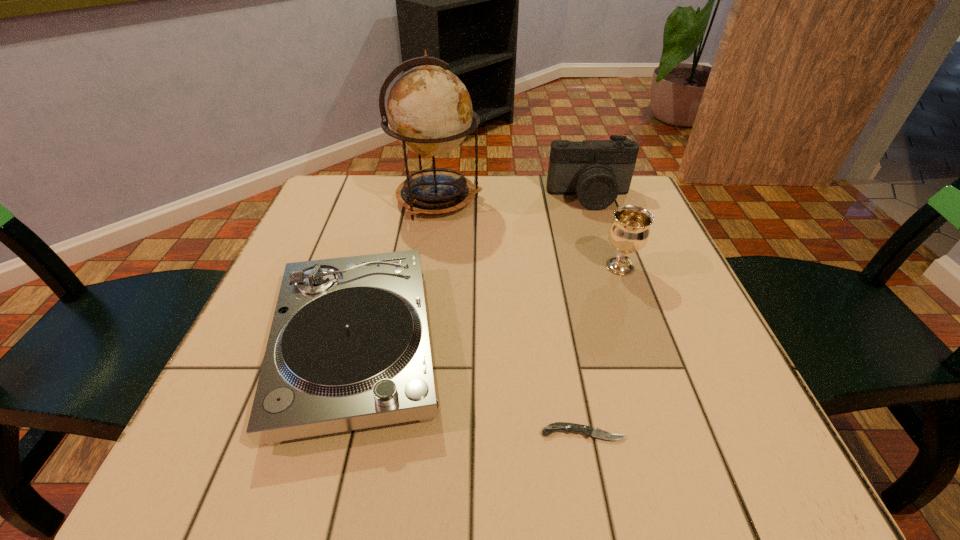
Identify the location of blank region between the chalice and the pocketknife. The height and width of the screenshot is (540, 960). (602, 350).

Identify the location of unoccupied position between the shortest object and the chalice. The width and height of the screenshot is (960, 540). (602, 350).

You are a GUI agent. You are given a task and a screenshot of the screen. Output one action in this format:
    pyautogui.click(x=<x>, y=<y>)
    Task: Click on the free space between the shortest object and the chalice
    Image resolution: width=960 pixels, height=540 pixels.
    Given the screenshot: What is the action you would take?
    pyautogui.click(x=602, y=350)

Find the location of `free point between the second shortest object and the pocketknife`. free point between the second shortest object and the pocketknife is located at coordinates (469, 389).

The image size is (960, 540). What are the coordinates of `empty space that is in between the globe and the shortest object` in the screenshot? It's located at (511, 316).

Select which object is the third closest to the fourth tallest object. Please provide its 2D coordinates. Your answer should be formatted as a tuple, i.e. [(x, y)], where the tuple contains the x and y coordinates of a point satisfying the conditions above.

[(629, 232)]

Find the location of a particular element. This screenshot has width=960, height=540. the second closest object to the pocketknife is located at coordinates [629, 232].

I want to click on free point that satisfies the following two spatial constraints: 1. at the center of the globe; 2. on the front side of the fourth tallest object, so (x=419, y=345).

Where is `vacant point that satisfies the following two spatial constraints: 1. at the center of the tallest object; 2. on the back side of the chalice`? vacant point that satisfies the following two spatial constraints: 1. at the center of the tallest object; 2. on the back side of the chalice is located at coordinates (429, 267).

At what (x,y) coordinates should I click in order to perform the action: click on vacant space that satisfies the following two spatial constraints: 1. at the center of the globe; 2. on the left side of the pocketknife. Please return your answer as a coordinate pair (x, y). Looking at the image, I should click on (407, 433).